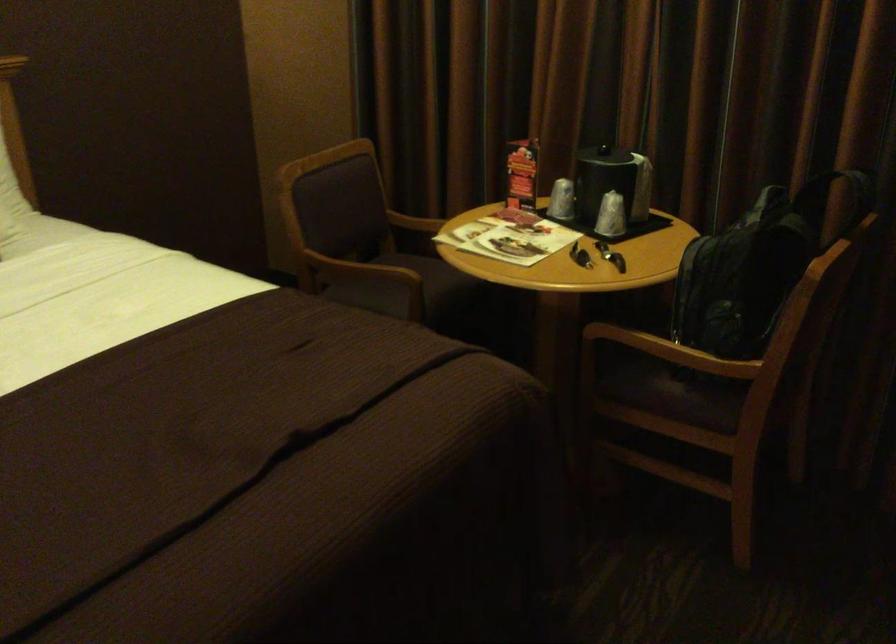
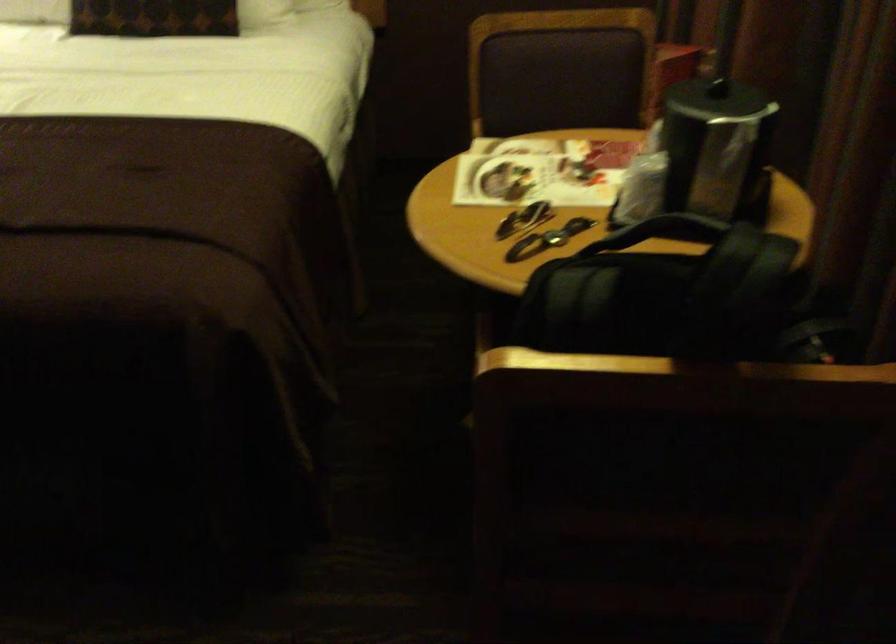
In the second image, find the point that corresponds to pixel 354 221 in the first image.

(553, 113)